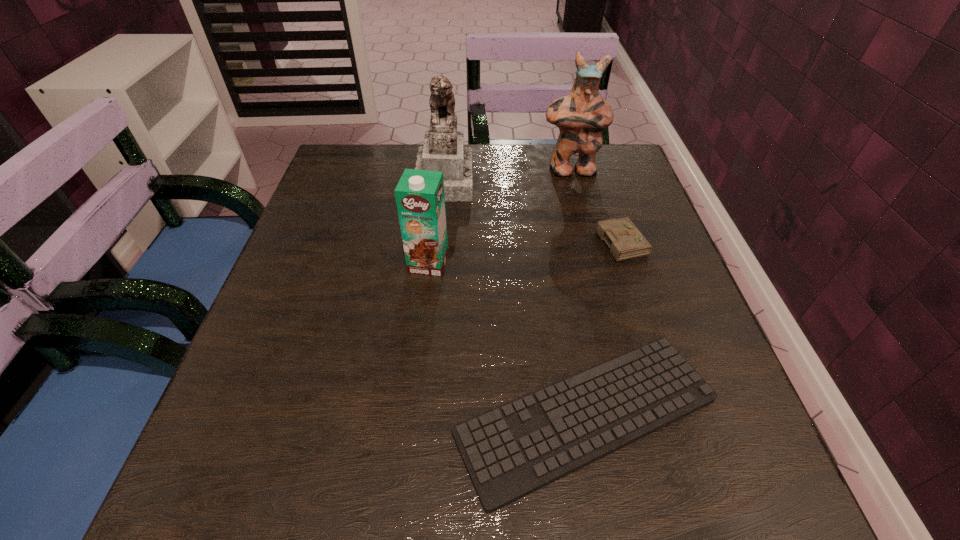
The height and width of the screenshot is (540, 960). I want to click on vacant area situated on the back of the computer keyboard, so click(564, 294).

The height and width of the screenshot is (540, 960). In order to click on object that is at the near edge in this screenshot , I will do `click(512, 450)`.

Find the location of a particular element. figurine that is positioned at the right edge is located at coordinates (581, 116).

I want to click on diary situated at the right edge, so click(625, 241).

Identify the location of computer keyboard at the right edge. (512, 450).

You are a GUI agent. You are given a task and a screenshot of the screen. Output one action in this format:
    pyautogui.click(x=<x>, y=<y>)
    Task: Click on the object that is at the far right corner
    The width and height of the screenshot is (960, 540).
    Given the screenshot: What is the action you would take?
    pyautogui.click(x=581, y=116)

Identify the location of object at the near right corner. This screenshot has width=960, height=540. (512, 450).

Locate an element on the screen. Image resolution: width=960 pixels, height=540 pixels. vacant area at the far edge of the desktop is located at coordinates (572, 187).

At what (x,y) coordinates should I click in order to perform the action: click on free point at the near edge. Please return your answer as a coordinate pair (x, y). Image resolution: width=960 pixels, height=540 pixels. Looking at the image, I should click on (379, 487).

In the image, there is a desktop. Where is `free space at the left edge`? This screenshot has width=960, height=540. free space at the left edge is located at coordinates (335, 198).